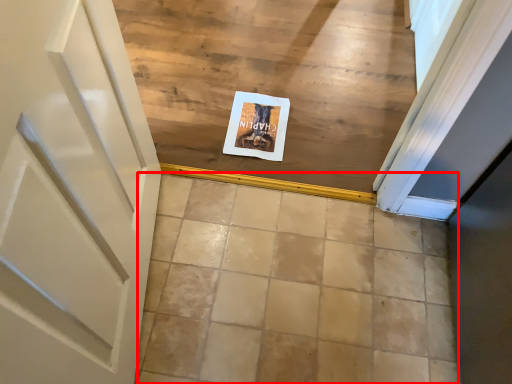
Question: Observing the image, what is the correct spatial positioning of ceramic tile (annotated by the red box) in reference to postcard?

Choices:
 (A) right
 (B) left

Answer: (A)